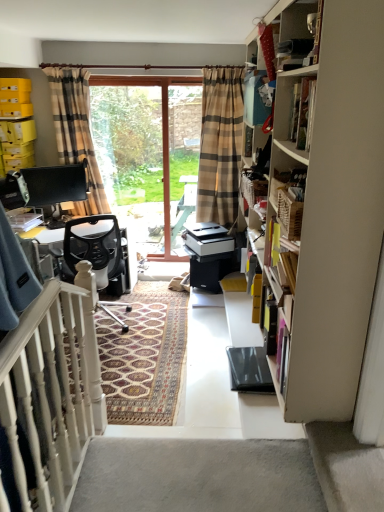
The height and width of the screenshot is (512, 384). What do you see at coordinates (54, 386) in the screenshot?
I see `white wooden balustrade at lower left` at bounding box center [54, 386].

What do you see at coordinates (149, 157) in the screenshot?
I see `clear glass screen door at center` at bounding box center [149, 157].

Find the location of a particular element. The height and width of the screenshot is (512, 384). clear glass screen door at center is located at coordinates (149, 157).

The image size is (384, 512). What do you see at coordinates (76, 132) in the screenshot?
I see `plaid fabric curtain at left` at bounding box center [76, 132].

Identify the location of wooden cabinet at upper right. This screenshot has width=384, height=512. (299, 33).

Locate an element on the screen. The image size is (384, 512). white wooden balustrade at lower left is located at coordinates (54, 386).

Considering the sizes of objects clear glass screen door at center and white carpet at lower right in the image provided, who is shorter, clear glass screen door at center or white carpet at lower right?

With less height is white carpet at lower right.

In the scene shown: From the image's perspective, which is below, clear glass screen door at center or white carpet at lower right?

white carpet at lower right is shown below in the image.

Can you tell me how much clear glass screen door at center and white carpet at lower right differ in facing direction?

clear glass screen door at center and white carpet at lower right are facing 90.8 degrees away from each other.

In the scene shown: From a real-world perspective, which object rests below the other?

From a 3D spatial view, black mesh office chair at center is below.

How different are the orientations of black mesh office chair at center and wooden cabinet at upper right in degrees?

59 degrees separate the facing orientations of black mesh office chair at center and wooden cabinet at upper right.

Can you confirm if black mesh office chair at center is positioned to the right of wooden cabinet at upper right?

No.

Considering the points (92, 254) and (313, 24), which point is behind, point (92, 254) or point (313, 24)?

The point (92, 254) is more distant.

The width and height of the screenshot is (384, 512). I want to click on screen door located behind the wooden cabinet at upper right, so click(x=149, y=157).

Between clear glass screen door at center and wooden cabinet at upper right, which one has larger width?

Wider between the two is wooden cabinet at upper right.

From the picture: Is wooden cabinet at upper right at the back of clear glass screen door at center?

clear glass screen door at center does not have its back to wooden cabinet at upper right.

Considering the relative sizes of clear glass screen door at center and wooden cabinet at upper right in the image provided, is clear glass screen door at center taller than wooden cabinet at upper right?

Correct, clear glass screen door at center is much taller as wooden cabinet at upper right.

From the image's perspective, is wooden cabinet at upper right over white wooden balustrade at lower left?

Yes, from the image's perspective, wooden cabinet at upper right is on top of white wooden balustrade at lower left.

Identify the location of cabinet above the white wooden balustrade at lower left (from the image's perspective). This screenshot has height=512, width=384. (299, 33).

Which is more to the right, wooden cabinet at upper right or white wooden balustrade at lower left?

Positioned to the right is wooden cabinet at upper right.

Do you think wooden cabinet at upper right is within plaid fabric curtain at left, or outside of it?

wooden cabinet at upper right is not inside plaid fabric curtain at left, it's outside.

Are wooden cabinet at upper right and plaid fabric curtain at left far apart?

Yes, wooden cabinet at upper right and plaid fabric curtain at left are quite far apart.

Considering the positions of objects white carpet at lower right and black mesh office chair at center in the image provided, who is in front, white carpet at lower right or black mesh office chair at center?

Positioned in front is white carpet at lower right.

Is white carpet at lower right to the left of black mesh office chair at center from the viewer's perspective?

No.

Is point (313, 433) less distant than point (123, 325)?

That is True.

Could black mesh office chair at center be considered to be inside white carpet at lower right?

No, black mesh office chair at center is located outside of white carpet at lower right.

From a real-world perspective, is clear glass screen door at center on top of black mesh office chair at center?

Yes.

In the scene shown: Considering the relative positions of clear glass screen door at center and black mesh office chair at center in the image provided, is clear glass screen door at center behind black mesh office chair at center?

Yes, clear glass screen door at center is further from the camera.

Is clear glass screen door at center looking in the opposite direction of black mesh office chair at center?

That's not correct — clear glass screen door at center is not looking away from black mesh office chair at center.

Considering the positions of objects clear glass screen door at center and black mesh office chair at center in the image provided, who is more to the right, clear glass screen door at center or black mesh office chair at center?

Positioned to the right is clear glass screen door at center.

Locate an element on the screen. Image resolution: width=384 pixels, height=512 pixels. stairwell on the right side of clear glass screen door at center is located at coordinates (346, 467).

Where is `chair behind the wooden cabinet at upper right`? chair behind the wooden cabinet at upper right is located at coordinates (91, 248).

Based on the photo, considering their positions, is black mesh office chair at center positioned further to white carpet at lower right than clear glass screen door at center?

Among the two, clear glass screen door at center is located further to white carpet at lower right.

Which object lies further to the anchor point plaid fabric curtain at left, clear glass screen door at center or black mesh office chair at center?

The object further to plaid fabric curtain at left is black mesh office chair at center.

From the image, which object appears to be nearer to plaid fabric curtain at left, black mesh office chair at center or wooden cabinet at upper right?

black mesh office chair at center.

Considering their positions, is clear glass screen door at center positioned closer to white wooden balustrade at lower left than black mesh office chair at center?

The object closer to white wooden balustrade at lower left is black mesh office chair at center.

Considering their positions, is white carpet at lower right positioned further to plaid fabric curtain at left than clear glass screen door at center?

white carpet at lower right is positioned further to the anchor plaid fabric curtain at left.

Based on their spatial positions, is wooden cabinet at upper right or white carpet at lower right closer to plaid fabric curtain at left?

The object closer to plaid fabric curtain at left is wooden cabinet at upper right.

From the image, which object appears to be farther from plaid fabric curtain at left, clear glass screen door at center or white carpet at lower right?

white carpet at lower right is further to plaid fabric curtain at left.

When comparing their distances from clear glass screen door at center, does white wooden balustrade at lower left or black mesh office chair at center seem closer?

black mesh office chair at center is positioned closer to the anchor clear glass screen door at center.

Locate an element on the screen. stairwell positioned between white wooden balustrade at lower left and black mesh office chair at center from near to far is located at coordinates (346, 467).

This screenshot has height=512, width=384. I want to click on chair located between wooden cabinet at upper right and clear glass screen door at center in the depth direction, so click(x=91, y=248).

Where is `cabinet positioned between white wooden balustrade at lower left and black mesh office chair at center from near to far`? The width and height of the screenshot is (384, 512). cabinet positioned between white wooden balustrade at lower left and black mesh office chair at center from near to far is located at coordinates (299, 33).

Where is `cabinet between white wooden balustrade at lower left and clear glass screen door at center in the front-back direction`? This screenshot has width=384, height=512. cabinet between white wooden balustrade at lower left and clear glass screen door at center in the front-back direction is located at coordinates (299, 33).